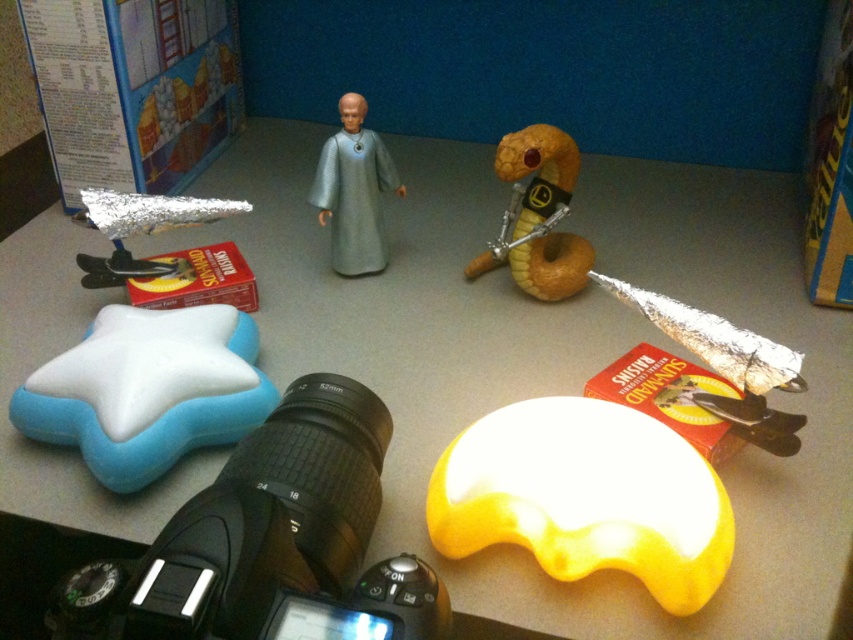
Question: Is shiny gold snake at center to the left of satin silver figure at center from the viewer's perspective?

Choices:
 (A) yes
 (B) no

Answer: (B)

Question: Which is nearer to the blue soft star at lower left?

Choices:
 (A) satin silver figure at center
 (B) black plastic camera at lower left

Answer: (B)

Question: Can you confirm if yellow rubber star at lower left is wider than shiny gold snake at center?

Choices:
 (A) no
 (B) yes

Answer: (B)

Question: Which point is closer to the camera?

Choices:
 (A) satin silver figure at center
 (B) yellow rubber star at lower left

Answer: (B)

Question: Can you confirm if black plastic camera at lower left is positioned to the right of blue soft star at lower left?

Choices:
 (A) yes
 (B) no

Answer: (A)

Question: Which of the following is the farthest from the observer?

Choices:
 (A) blue soft star at lower left
 (B) shiny gold snake at center

Answer: (B)